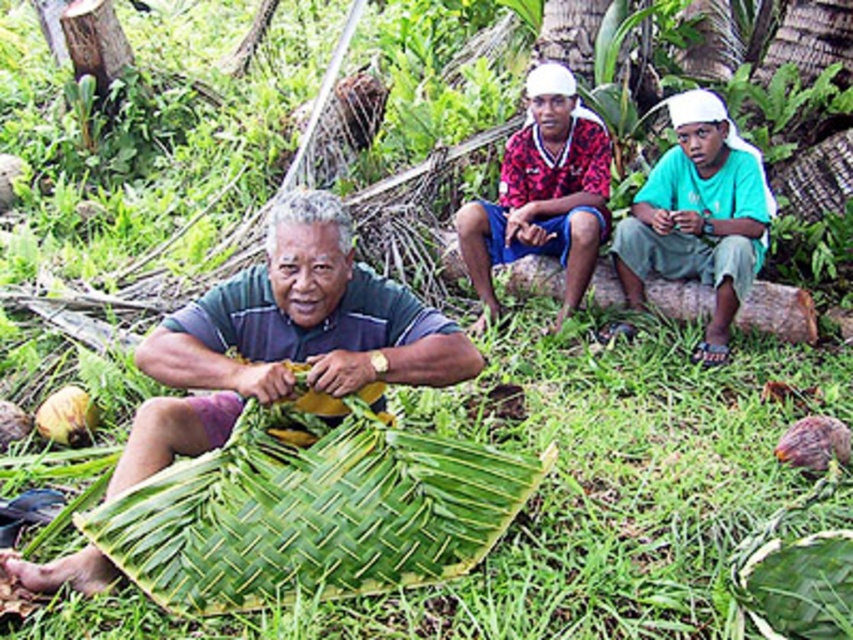
Question: Is green leafy grass at center to the right of green woven mat at center from the viewer's perspective?

Choices:
 (A) yes
 (B) no

Answer: (A)

Question: Is green woven leaf at center closer to the viewer compared to green woven mat at center?

Choices:
 (A) no
 (B) yes

Answer: (B)

Question: Can you confirm if green woven mat at center is positioned below green cotton shirt at upper right?

Choices:
 (A) no
 (B) yes

Answer: (B)

Question: Estimate the real-world distances between objects in this image. Which object is farther from the green woven leaf at center?

Choices:
 (A) green woven mat at center
 (B) green cotton shirt at upper right
 (C) green leafy grass at center
 (D) printed fabric shirt at upper right

Answer: (B)

Question: Which point is farther from the camera taking this photo?

Choices:
 (A) (714, 216)
 (B) (358, 310)
 (C) (495, 304)

Answer: (C)

Question: Which of these objects is positioned closest to the green cotton shirt at upper right?

Choices:
 (A) green woven mat at center
 (B) printed fabric shirt at upper right
 (C) green woven leaf at center
 (D) green leafy grass at center

Answer: (B)